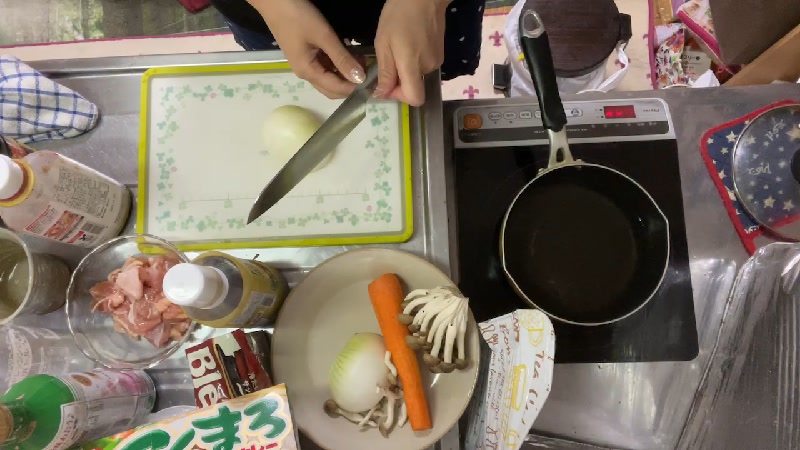
Locate an element on the screen. This screenshot has height=450, width=800. temperature screen is located at coordinates (622, 115).